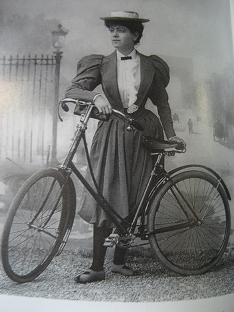
At what (x,y) coordinates should I click in order to perform the action: click on light. Please return your answer as a coordinate pair (x, y). Looking at the image, I should click on (58, 40).